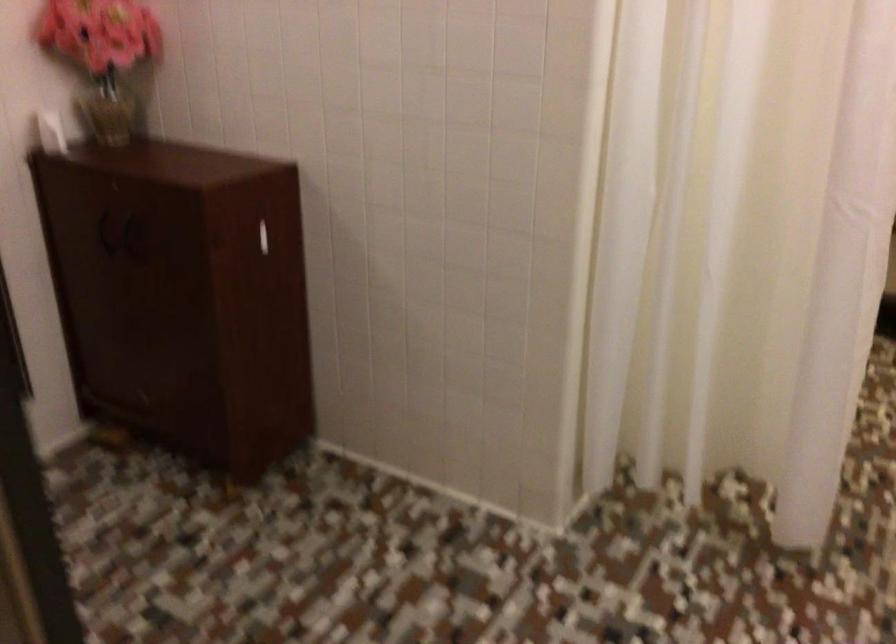
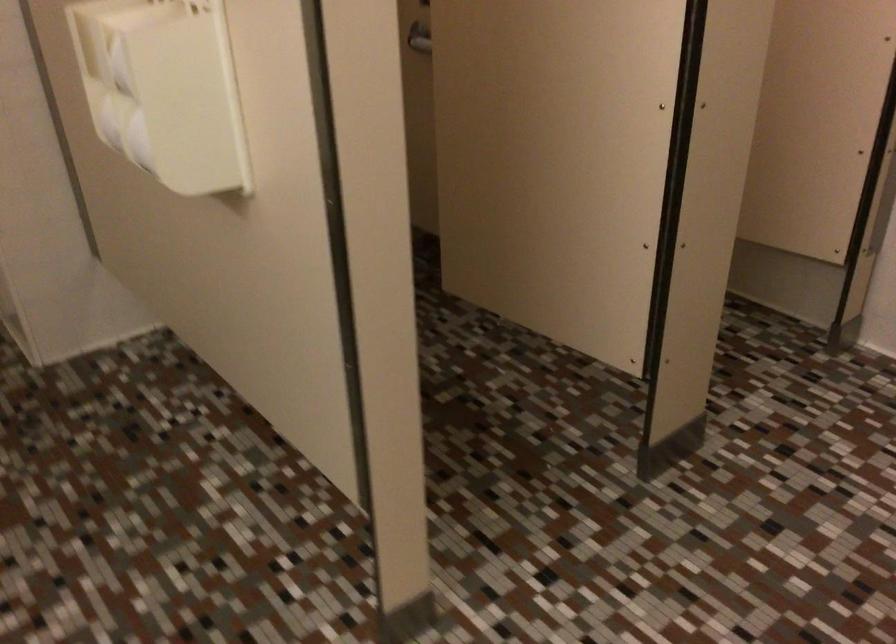
Based on the continuous images, in which direction is the camera rotating?

The camera's rotation is toward left-down.